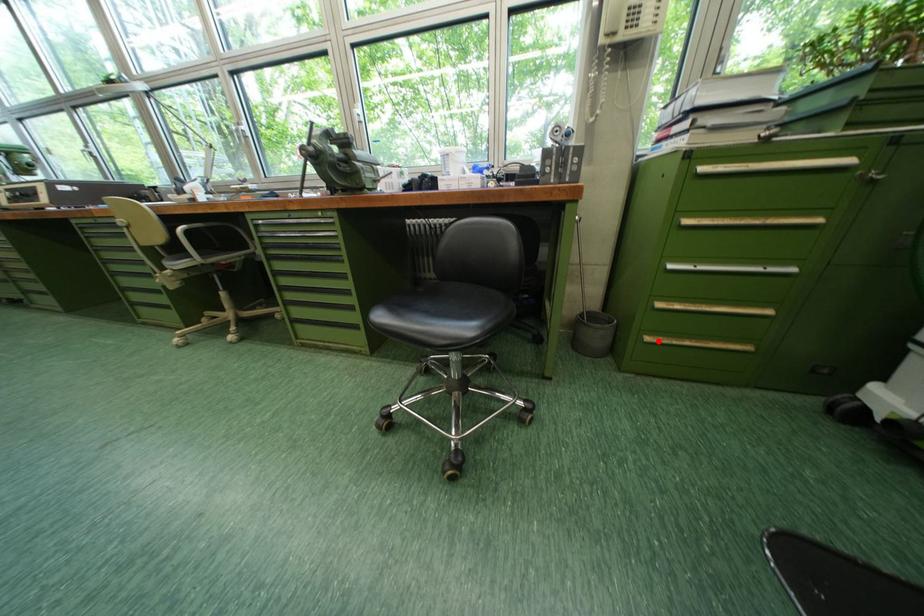
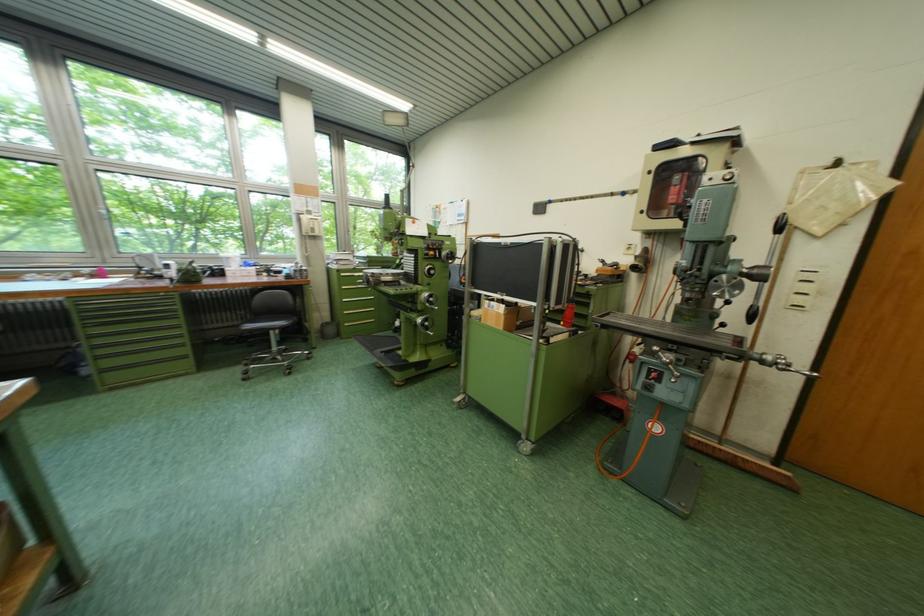
Question: A red point is marked in image1. In image2, is the corresponding 3D point closer to the camera or farther? Reply with the corresponding letter.

Choices:
 (A) The corresponding 3D point is closer.
 (B) The corresponding 3D point is farther.

Answer: (B)